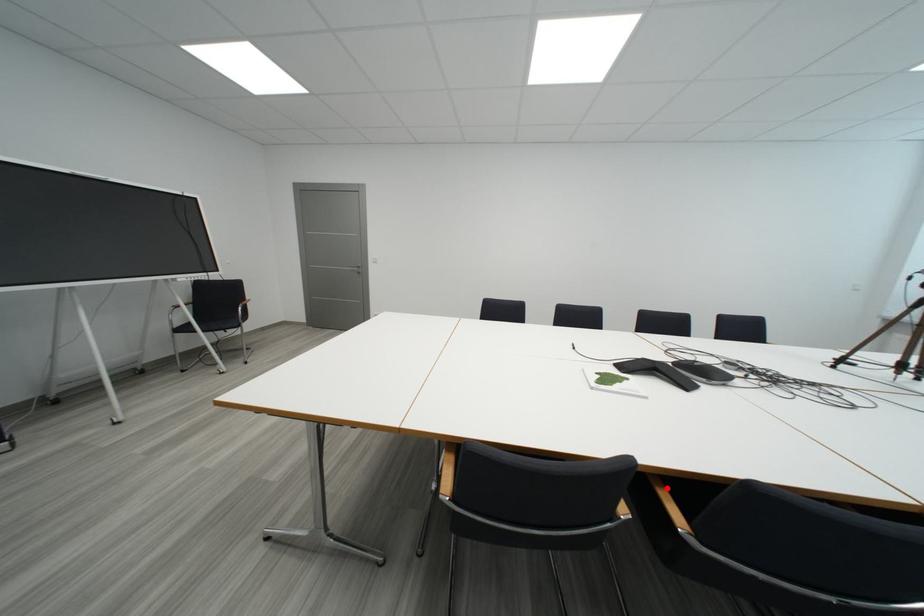
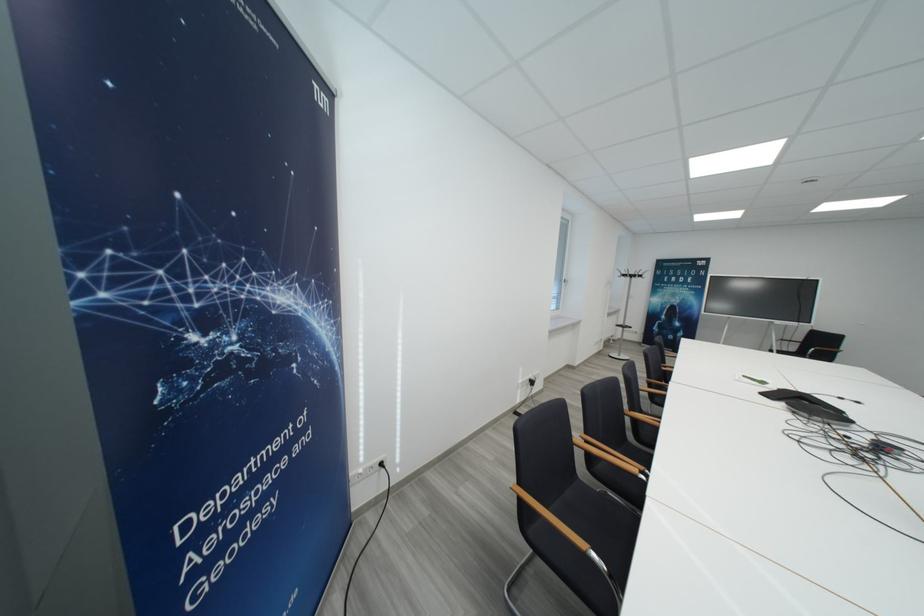
Question: I am providing you with two images of the same scene from different viewpoints. A red point is marked on the first image. At the location where the point appears in image 1, is it still visible in image 2?

Choices:
 (A) Yes
 (B) No

Answer: (B)